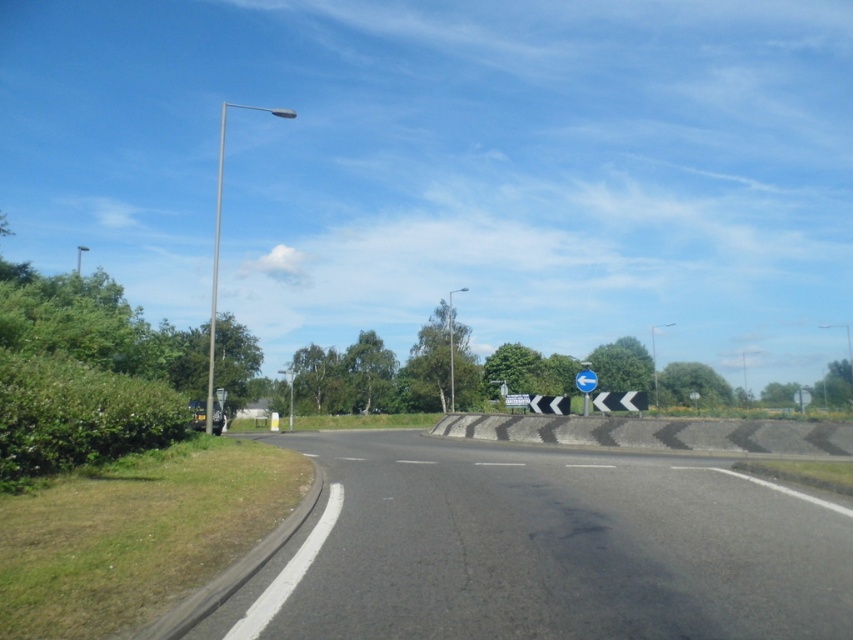
Question: Considering the relative positions of black asphalt barrier at center and blue plastic sign at center in the image provided, where is black asphalt barrier at center located with respect to blue plastic sign at center?

Choices:
 (A) left
 (B) right

Answer: (A)

Question: Considering the real-world distances, which object is closest to the black asphalt highway at lower left?

Choices:
 (A) metallic pole at left
 (B) black asphalt barrier at center

Answer: (B)

Question: Which of the following is the farthest from the observer?

Choices:
 (A) (512, 419)
 (B) (206, 401)

Answer: (B)

Question: Can you confirm if black asphalt highway at lower left is positioned to the left of metallic pole at left?

Choices:
 (A) no
 (B) yes

Answer: (A)

Question: Is black asphalt highway at lower left to the left of blue glossy sign at center from the viewer's perspective?

Choices:
 (A) yes
 (B) no

Answer: (A)

Question: Based on their relative distances, which object is nearer to the metallic pole at left?

Choices:
 (A) blue plastic sign at center
 (B) blue glossy sign at center
 (C) black asphalt barrier at center

Answer: (C)